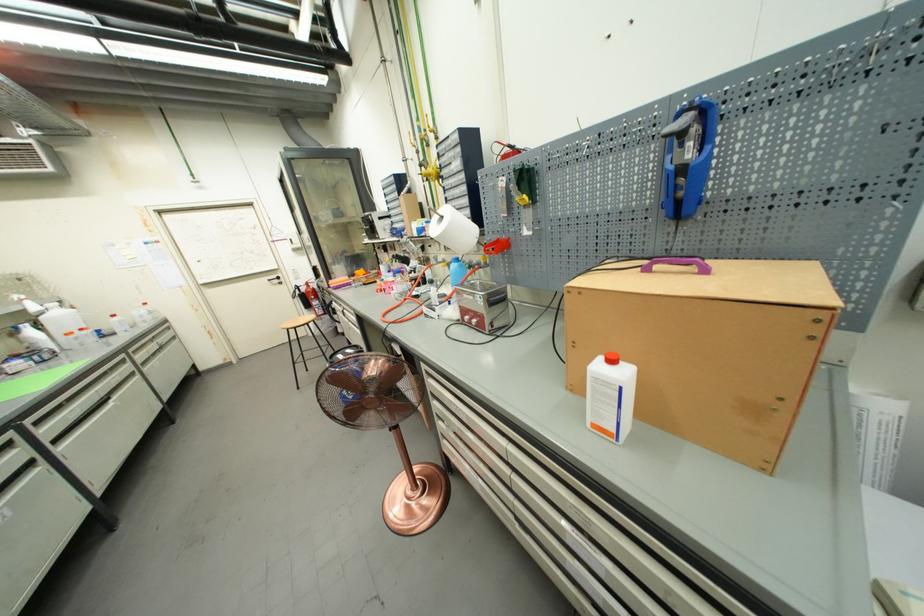
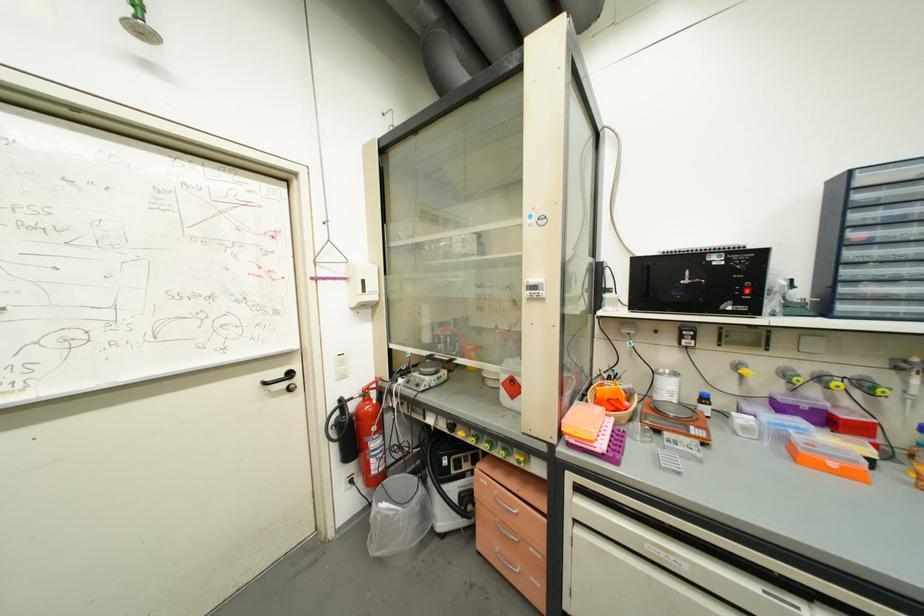
The point at (x=296, y=241) is marked in the first image. Where is the corresponding point in the second image?

(369, 283)